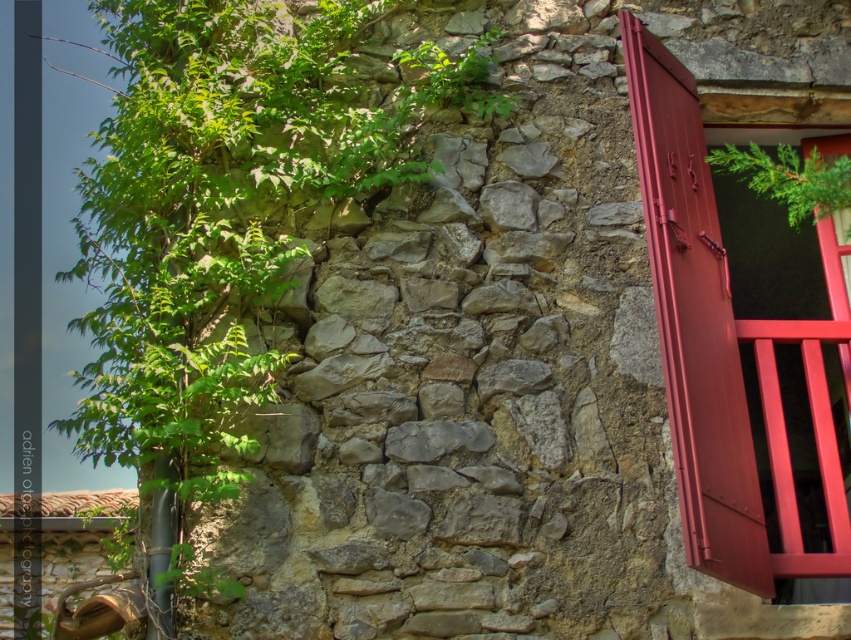
Based on the photo, you are a painter standing at the base of the rustic stone wall. You want to paint the green leafy plant at upper left and the matte red wooden door at right. If your ladder can reach up to 8 meters, can you paint both objects without moving the ladder?

The green leafy plant at upper left is 8.34 meters from the matte red wooden door at right. Since the ladder can only reach up to 8 meters, you cannot paint both objects without moving the ladder because the distance between them exceeds the ladder height limit.

You are an artist painting this scene. You need to paint the green leafy plant at upper left and the green leafy plant at upper right. According to the scene, which plant is positioned lower on the wall?

The green leafy plant at upper left is positioned below the green leafy plant at upper right, so it is lower on the wall.